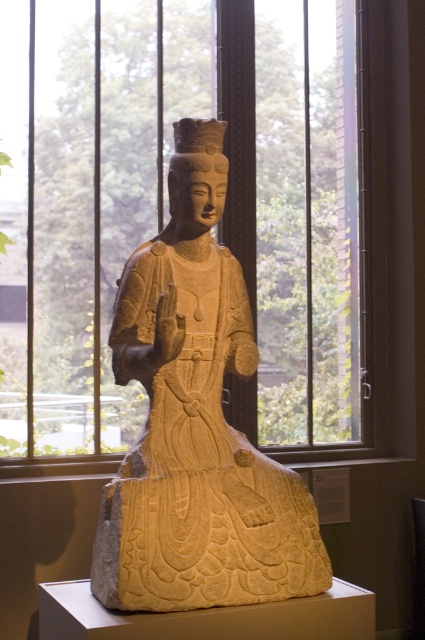
Question: Which object is farther from the camera taking this photo?

Choices:
 (A) matte stone statue at center
 (B) clear glass window at center

Answer: (B)

Question: Does clear glass window at center appear over matte stone statue at center?

Choices:
 (A) yes
 (B) no

Answer: (A)

Question: Which of the following is the farthest from the observer?

Choices:
 (A) (113, 561)
 (B) (291, 273)

Answer: (B)

Question: Is clear glass window at center below matte stone statue at center?

Choices:
 (A) no
 (B) yes

Answer: (A)

Question: Does clear glass window at center have a larger size compared to matte stone statue at center?

Choices:
 (A) yes
 (B) no

Answer: (A)

Question: Which point is farther from the camera taking this photo?

Choices:
 (A) (129, 296)
 (B) (362, 198)

Answer: (B)